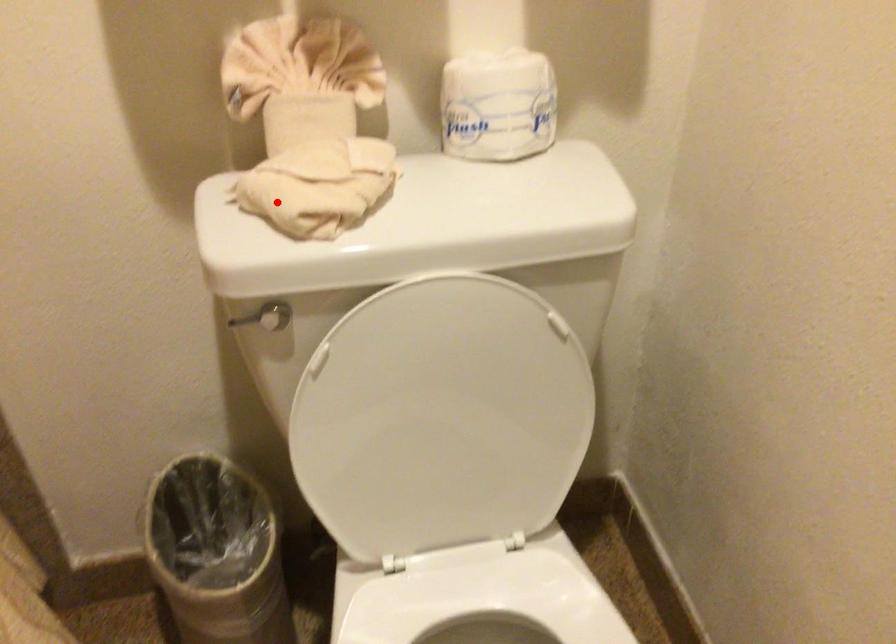
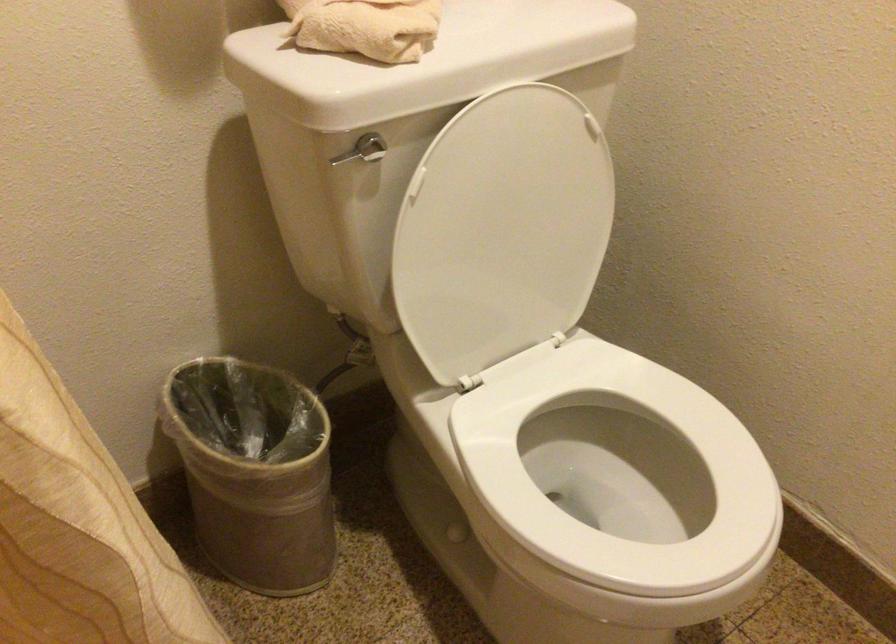
The point at the highlighted location is marked in the first image. Where is the corresponding point in the second image?

(365, 26)